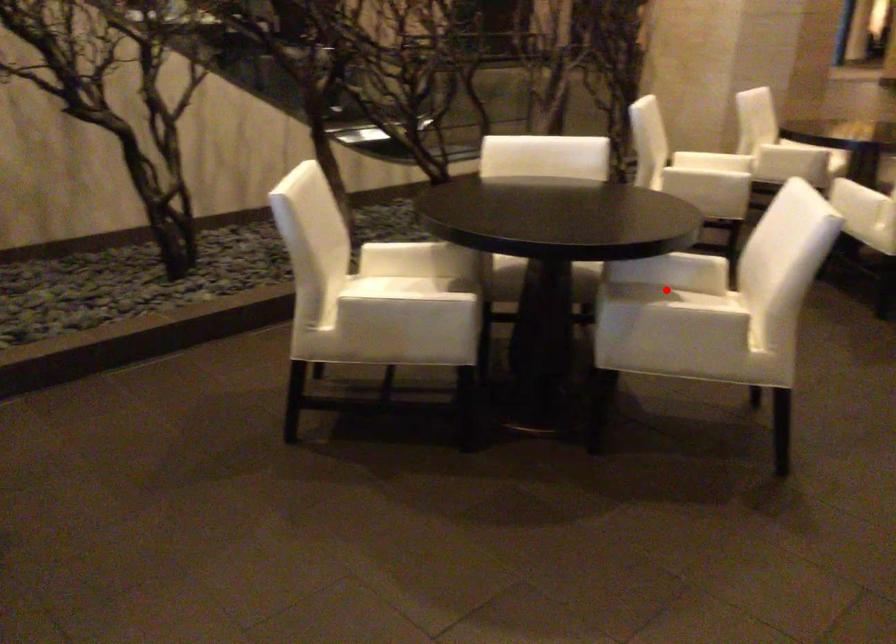
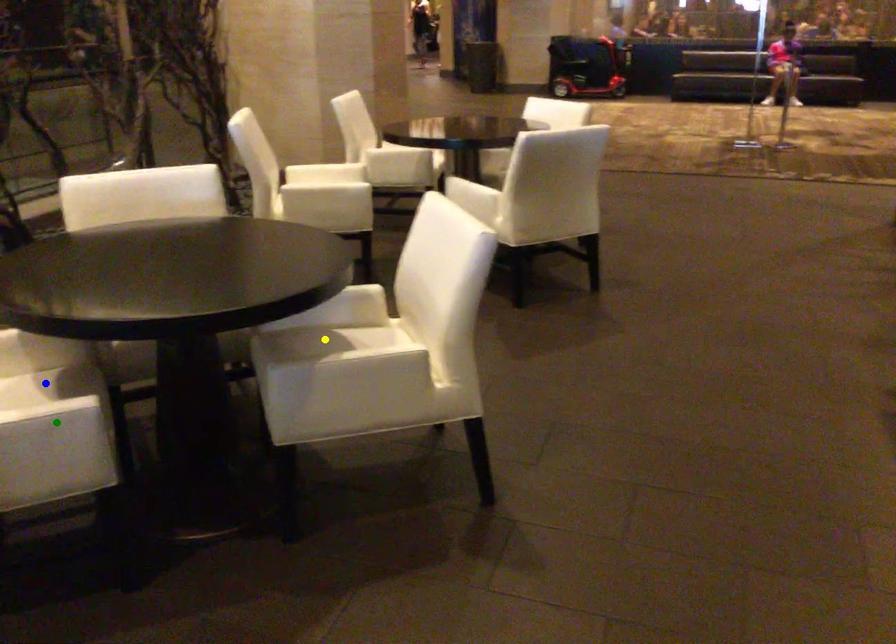
Question: I am providing you with two images of the same scene from different viewpoints. A red point is marked on the first image. You are given multiple points on the second image. Which point in image 2 represents the same 3d spot as the red point in image 1?

Choices:
 (A) blue point
 (B) green point
 (C) yellow point

Answer: (C)